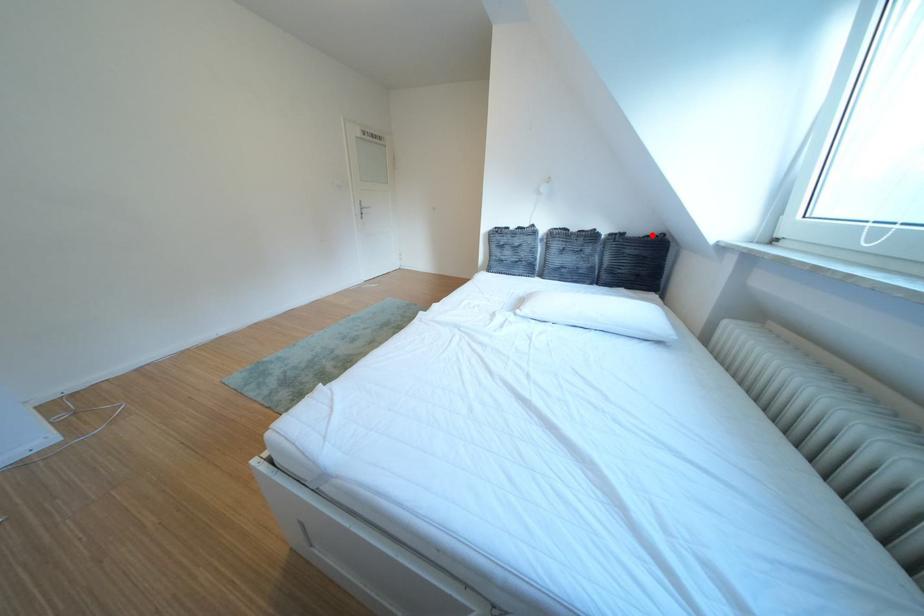
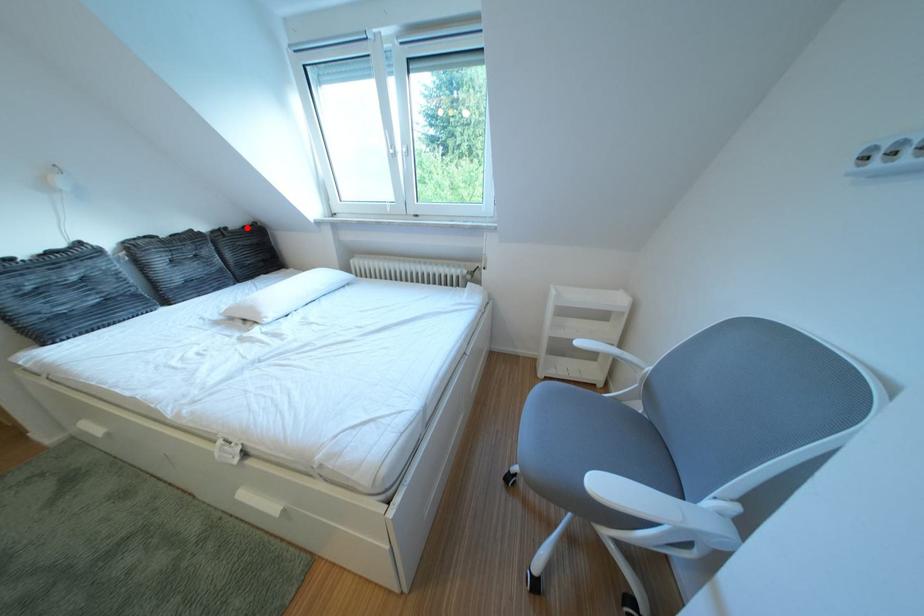
I am providing you with two images of the same scene from different viewpoints. A red point is marked on the first image and another point is marked on the second image. Do the highlighted points in image1 and image2 indicate the same real-world spot?

Yes